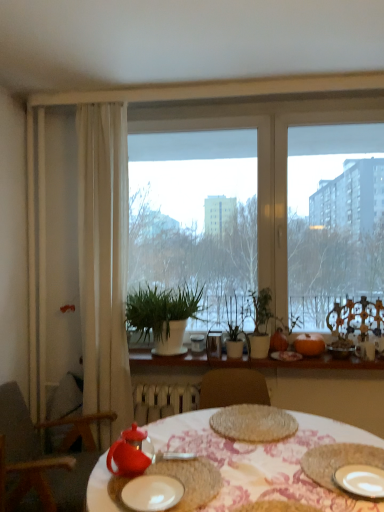
Locate an element on the screen. This screenshot has height=512, width=384. vacant space that's between rustic woven placemat at lower right and matte red teapot at lower left is located at coordinates (263, 474).